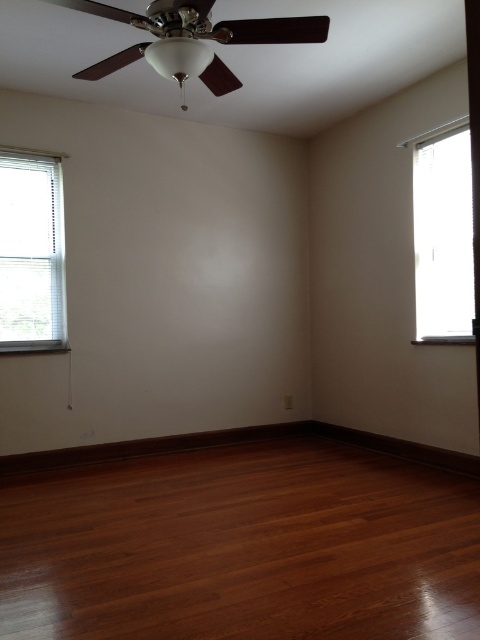
Question: Which of these objects is positioned closest to the clear glass window at right?

Choices:
 (A) brown glossy hardwood floor at lower center
 (B) white blinds at left

Answer: (A)

Question: In this image, where is brown glossy hardwood floor at lower center located relative to white blinds at left?

Choices:
 (A) above
 (B) below

Answer: (B)

Question: Which object appears farthest from the camera in this image?

Choices:
 (A) white blinds at left
 (B) clear glass window at right
 (C) brown glossy hardwood floor at lower center

Answer: (A)

Question: Does brown glossy hardwood floor at lower center have a lesser width compared to white blinds at left?

Choices:
 (A) yes
 (B) no

Answer: (B)

Question: Where is white blinds at left located in relation to clear glass window at right in the image?

Choices:
 (A) left
 (B) right

Answer: (A)

Question: Which of these objects is positioned farthest from the brown glossy hardwood floor at lower center?

Choices:
 (A) clear glass window at right
 (B) white blinds at left

Answer: (B)